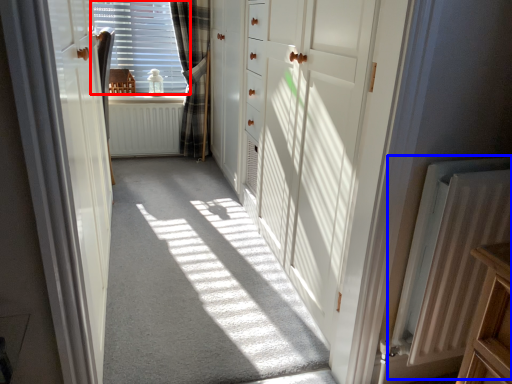
Question: Which object appears farthest to the camera in this image, window (highlighted by a red box) or radiator (highlighted by a blue box)?

Choices:
 (A) window
 (B) radiator

Answer: (A)